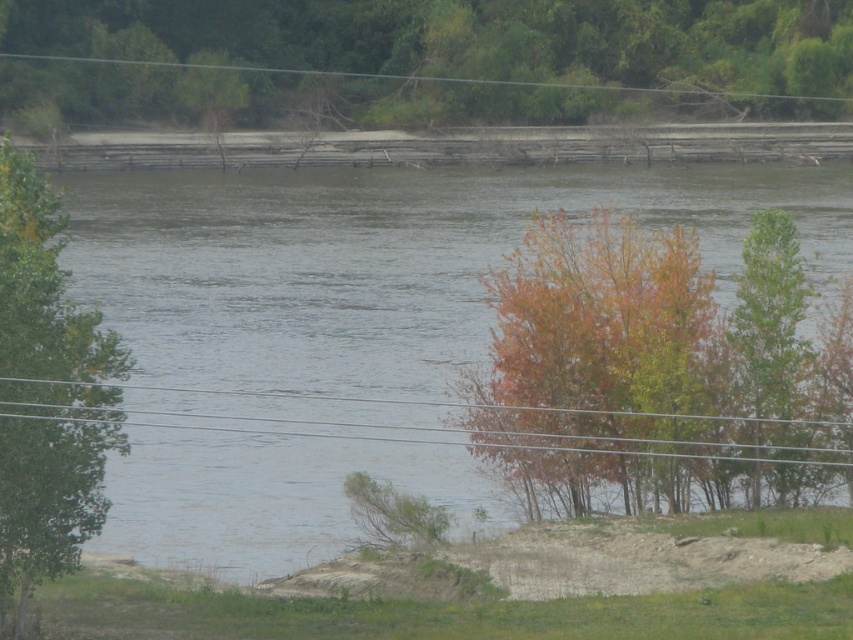
Who is shorter, green leafy tree at left or metallic wires at center?

Standing shorter between the two is metallic wires at center.

Is point (41, 189) positioned before point (743, 442)?

That is True.

Is point (19, 385) positioned behind point (793, 451)?

That is False.

Find the location of a particular element. This screenshot has height=640, width=853. green leafy tree at left is located at coordinates (45, 300).

Which is above, metallic wires at center or green wire at upper center?

Positioned higher is green wire at upper center.

Who is taller, metallic wires at center or green wire at upper center?

With more height is green wire at upper center.

Looking at this image, who is more forward, (230, 429) or (712, 92)?

Point (230, 429)

Find the location of a particular element. This screenshot has height=640, width=853. metallic wires at center is located at coordinates (544, 438).

Which is in front, point (791, 244) or point (169, 65)?

Point (791, 244)

Does point (784, 289) come behind point (358, 74)?

No, (784, 289) is closer to viewer.

At what (x,y) coordinates should I click in order to perform the action: click on green matte tree at right. Please return your answer as a coordinate pair (x, y). Looking at the image, I should click on (769, 324).